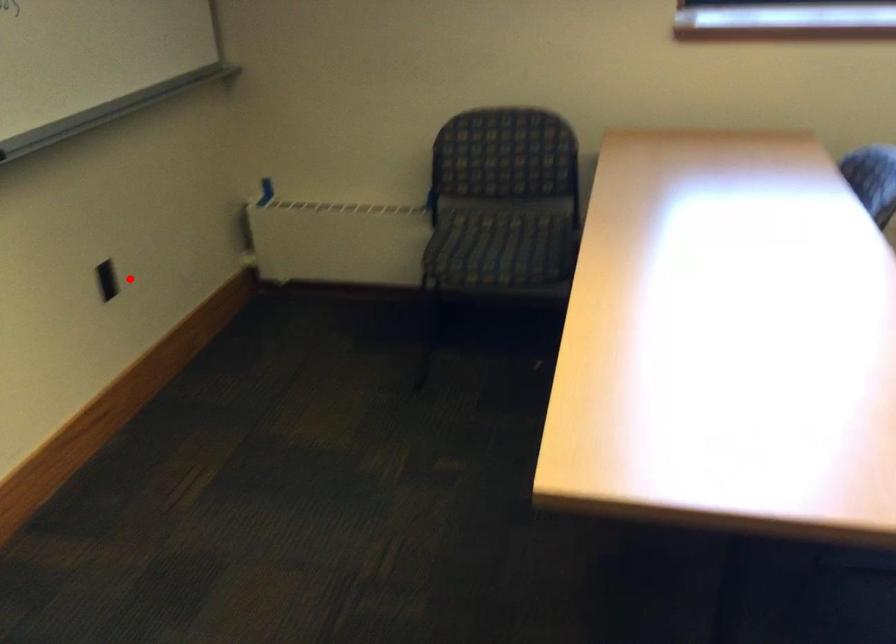
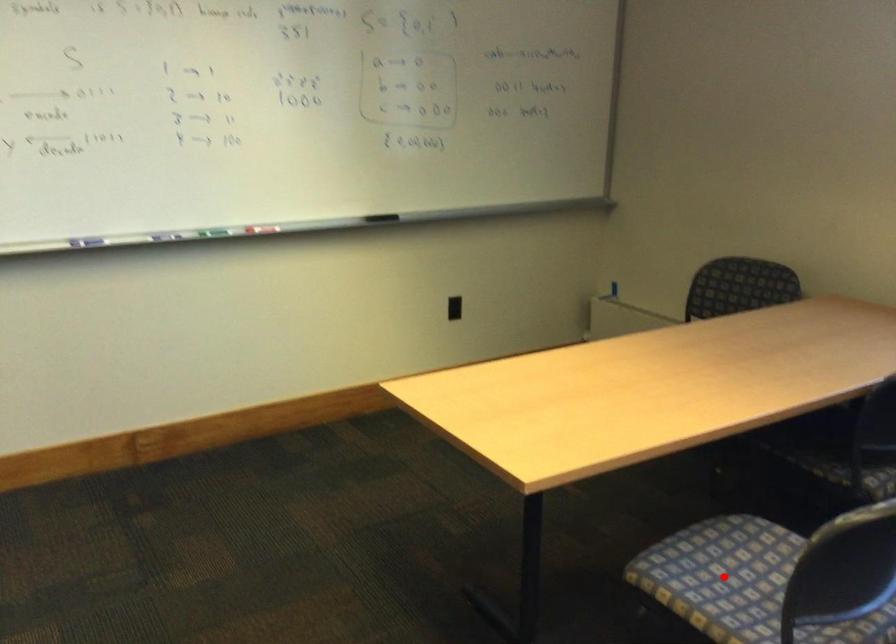
Looking at this image, I am providing you with two images of the same scene from different viewpoints. A red point is marked on the first image and another point is marked on the second image. Are the points marked in image1 and image2 representing the same 3D position?

No